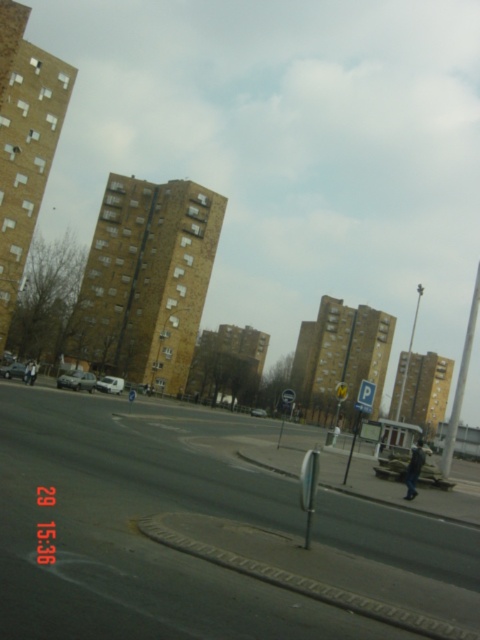
Can you confirm if silver metallic car at center is bigger than matte silver van at lower left?

Indeed, silver metallic car at center has a larger size compared to matte silver van at lower left.

Locate an element on the screen. silver metallic car at center is located at coordinates (76, 380).

Is point (96, 380) positioned after point (253, 410)?

No, (96, 380) is in front of (253, 410).

Does point (71, 372) come closer to viewer compared to point (263, 412)?

Yes, point (71, 372) is closer to viewer.

Where is `silver metallic car at center`? silver metallic car at center is located at coordinates (76, 380).

Can you confirm if smooth asphalt road at center is smaller than white matte van at center?

No, smooth asphalt road at center is not smaller than white matte van at center.

What do you see at coordinates (195, 532) in the screenshot?
I see `smooth asphalt road at center` at bounding box center [195, 532].

Does point (256, 618) come in front of point (113, 384)?

Yes, point (256, 618) is in front of point (113, 384).

Where is `smooth asphalt road at center`? smooth asphalt road at center is located at coordinates (195, 532).